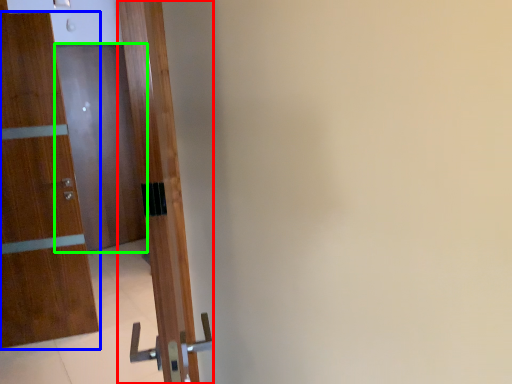
Question: Based on their relative distances, which object is nearer to door (highlighted by a red box)? Choose from door (highlighted by a blue box) and door (highlighted by a green box).

Choices:
 (A) door
 (B) door

Answer: (A)